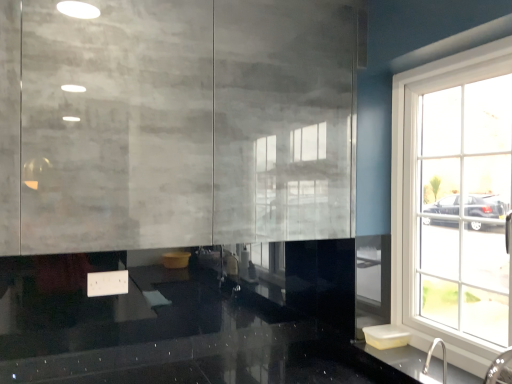
This screenshot has height=384, width=512. Describe the element at coordinates (386, 336) in the screenshot. I see `white plastic container at lower right` at that location.

Locate an element on the screen. The image size is (512, 384). white plastic container at lower right is located at coordinates (386, 336).

The image size is (512, 384). Find the location of `white plastic container at lower right`. white plastic container at lower right is located at coordinates (386, 336).